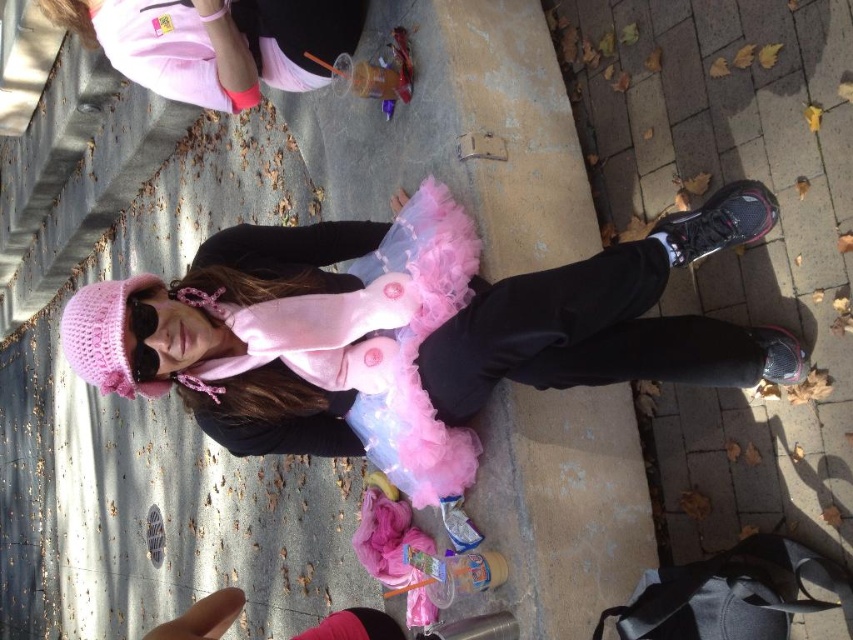
You are a photographer trying to capture the perfect shot of the fuzzy pink tutu at center. To ensure the tutu is in the center of the photo, where should you aim your camera?

You should aim your camera at point (422, 332) to center the fuzzy pink tutu at center.

You are standing at the position of the person in the image. You want to pick up an item located at point (450, 272) and another item at point (312, 29). Which item will you reach first if you move forward in a straight line?

Point (450, 272) is in front of point (312, 29), so you will reach the item at point (450, 272) first.

You are a fashion designer observing the person in the image. You notice the fuzzy pink tutu at center and the fuzzy pink dress at center. Which clothing item is positioned lower on the person?

The fuzzy pink tutu at center is below the fuzzy pink dress at center, so the tutu is positioned lower on the person.